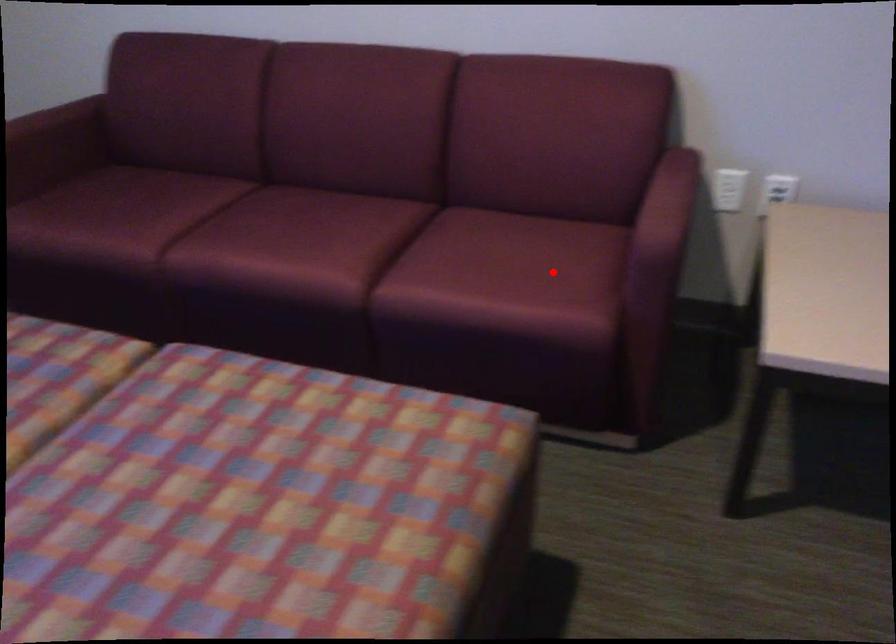
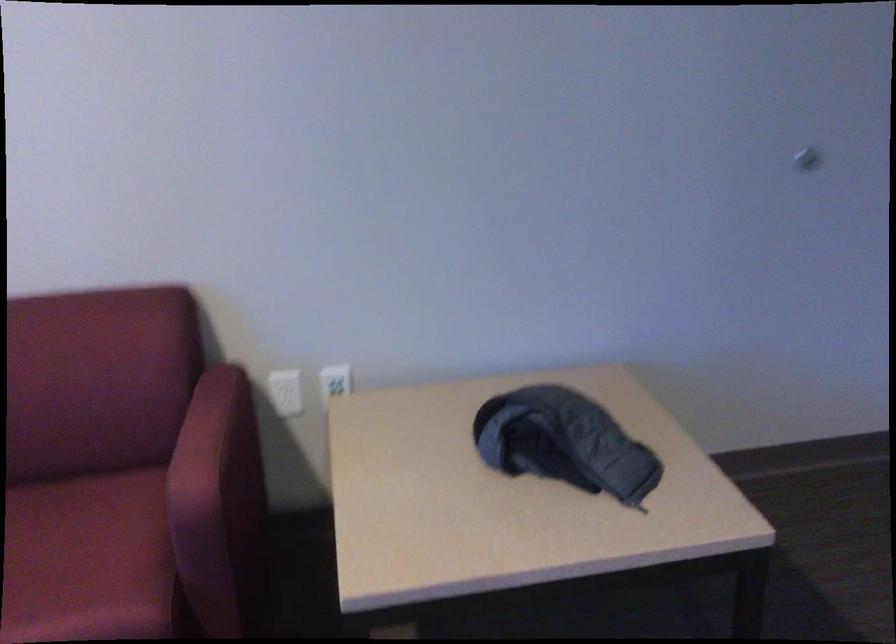
Where in the second image is the point corresponding to the highlighted location from the first image?

(88, 560)